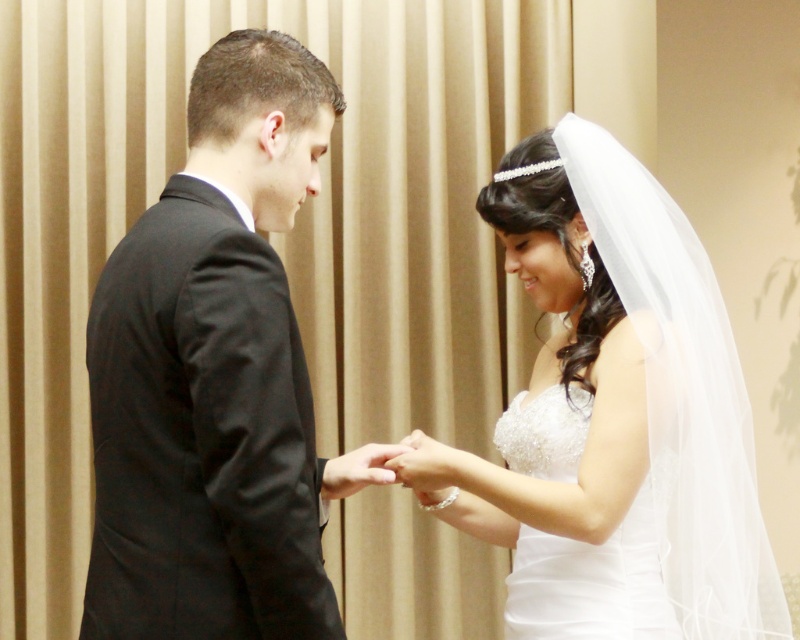
In the wedding scene, there is a point labeled as point (426,465). Based on the scene description, where is this point located?

The point (426,465) is located on the pearl white lace hand at center.

You are a photographer at the wedding and want to capture a clear shot of the couple. Since there are two white satin dresses at the center, which one is closer to you, the photographer, between the white satin dress at center and the white satin wedding dress at center?

The white satin dress at center is closer to you than the white satin wedding dress at center because it is in front of it.